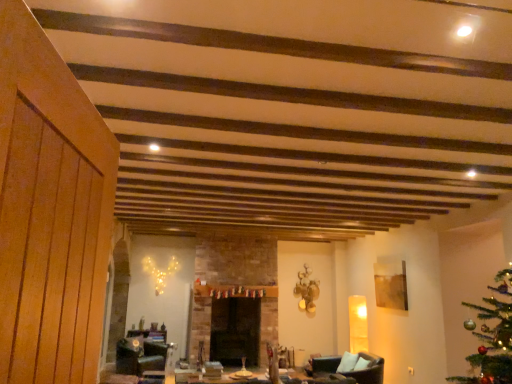
Question: Is black leather swivel chair at lower center inside or outside of black stone fireplace at center?

Choices:
 (A) inside
 (B) outside

Answer: (B)

Question: Considering the positions of black leather swivel chair at lower center and black stone fireplace at center in the image, is black leather swivel chair at lower center taller or shorter than black stone fireplace at center?

Choices:
 (A) tall
 (B) short

Answer: (B)

Question: Estimate the real-world distances between objects in this image. Which object is farther from the black leather swivel chair at lower center?

Choices:
 (A) black stone fireplace at center
 (B) brown leather armchair at lower right

Answer: (B)

Question: Which object is positioned closest to the black leather swivel chair at lower center?

Choices:
 (A) black stone fireplace at center
 (B) brown leather armchair at lower right

Answer: (A)